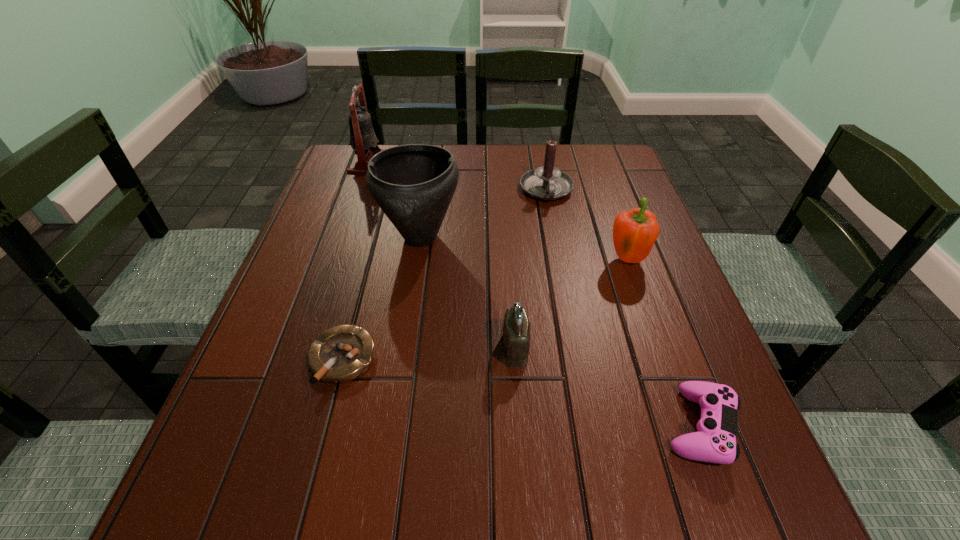
Locate an element on the screen. This screenshot has height=540, width=960. free spot between the ashtray and the urn is located at coordinates (381, 298).

The width and height of the screenshot is (960, 540). I want to click on empty space that is in between the candle and the fourth object from right to left, so click(x=531, y=269).

The height and width of the screenshot is (540, 960). What are the coordinates of `free space that is in between the fourth object from left to right and the third object from right to left` in the screenshot? It's located at (531, 269).

You are a GUI agent. You are given a task and a screenshot of the screen. Output one action in this format:
    pyautogui.click(x=<x>, y=<y>)
    Task: Click on the vacant region between the sixth tallest object and the shortest object
    The height and width of the screenshot is (540, 960).
    Given the screenshot: What is the action you would take?
    pyautogui.click(x=521, y=392)

The image size is (960, 540). I want to click on free space between the urn and the pepper, so click(x=523, y=248).

The image size is (960, 540). I want to click on object that is the fourth closest to the shortest object, so click(547, 182).

Where is `object that stands as the closest to the second shortest object`? Image resolution: width=960 pixels, height=540 pixels. object that stands as the closest to the second shortest object is located at coordinates (516, 328).

At what (x,y) coordinates should I click in order to perform the action: click on vacant space that satisfies the following two spatial constraints: 1. on the front side of the control; 2. on the left side of the urn. Please return your answer as a coordinate pair (x, y). Looking at the image, I should click on (392, 427).

At what (x,y) coordinates should I click in order to perform the action: click on free space that satisfies the following two spatial constraints: 1. on the side of the candle with the handle loop; 2. on the right side of the sixth tallest object. Please return your answer as a coordinate pair (x, y). Looking at the image, I should click on (590, 427).

Where is `vacant space that satisfies the following two spatial constraints: 1. on the side of the candle with the handle loop; 2. on the left side of the sixth tallest object`? This screenshot has width=960, height=540. vacant space that satisfies the following two spatial constraints: 1. on the side of the candle with the handle loop; 2. on the left side of the sixth tallest object is located at coordinates (590, 427).